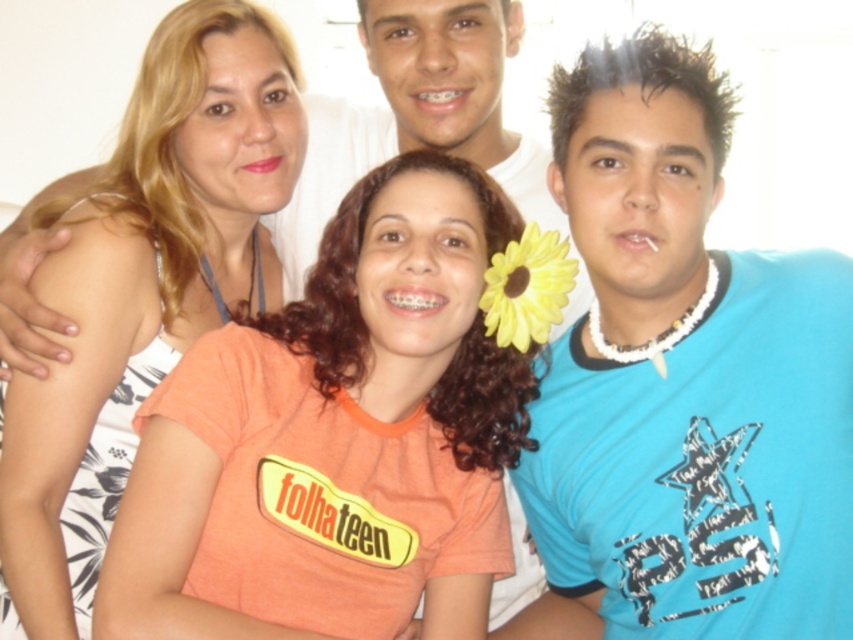
Which object is located at the coordinates point (683, 381)?

The blue printed t shirt at center is located at point (683, 381).